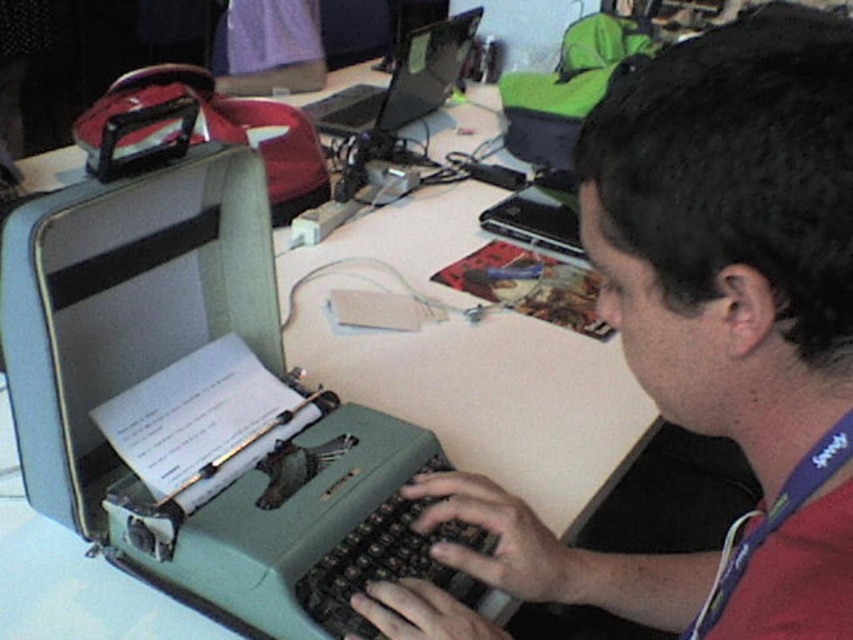
Question: Which object appears farthest from the camera in this image?

Choices:
 (A) white plastic table at center
 (B) black glossy laptop at upper center
 (C) matte green typewriter at center

Answer: (B)

Question: Which point is farther to the camera?

Choices:
 (A) (450, 58)
 (B) (625, 262)
 (C) (350, 339)

Answer: (A)

Question: Is white plastic table at center to the right of black glossy laptop at upper center from the viewer's perspective?

Choices:
 (A) yes
 (B) no

Answer: (A)

Question: From the image, what is the correct spatial relationship of matte green typewriter at center in relation to black glossy laptop at upper center?

Choices:
 (A) above
 (B) below

Answer: (B)

Question: Among these points, which one is farthest from the camera?

Choices:
 (A) (486, 396)
 (B) (480, 12)
 (C) (761, 124)

Answer: (B)

Question: Is white plastic table at center thinner than black glossy laptop at upper center?

Choices:
 (A) yes
 (B) no

Answer: (B)